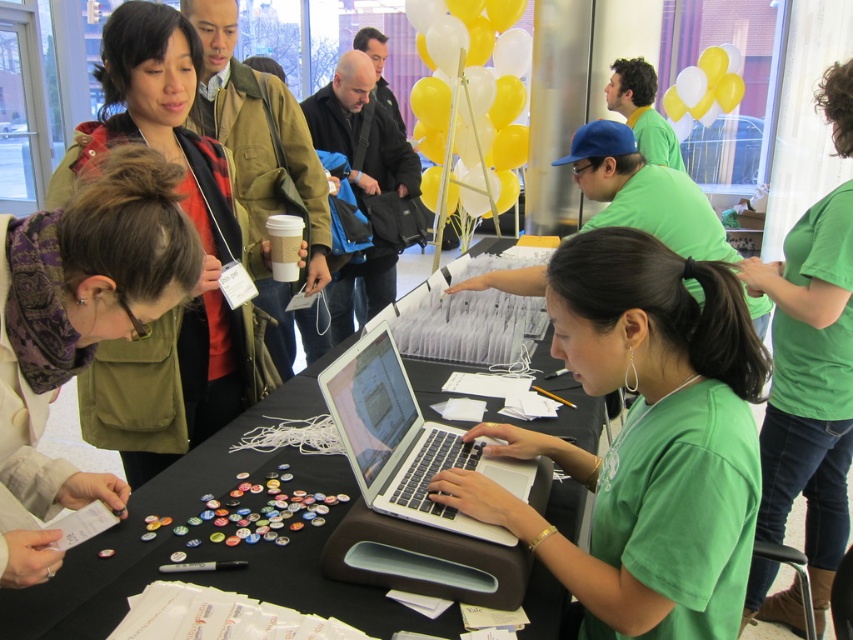
Based on the photo, you are a photographer at the event and want to capture a photo of both yellow matte balloons at upper center and yellow matte balloons at upper right in the same frame. Which balloon should you focus on to ensure both are clearly visible?

You should focus on the yellow matte balloons at upper center because it is larger and will be more prominent in the photo, ensuring both balloons are clearly visible.

You are attending an event and need to locate the registration desk. You see an olive green jacket at upper left and a silver metallic laptop at center. Which object is positioned higher in the image?

The olive green jacket at upper left is located above the silver metallic laptop at center in the image.

You are organizing a clothing donation drive and need to determine which shirt takes up more space horizontally. Which shirt between the green matte shirt at center and the green cotton shirt at upper right has a greater width?

The green matte shirt at center has a greater width than the green cotton shirt at upper right.